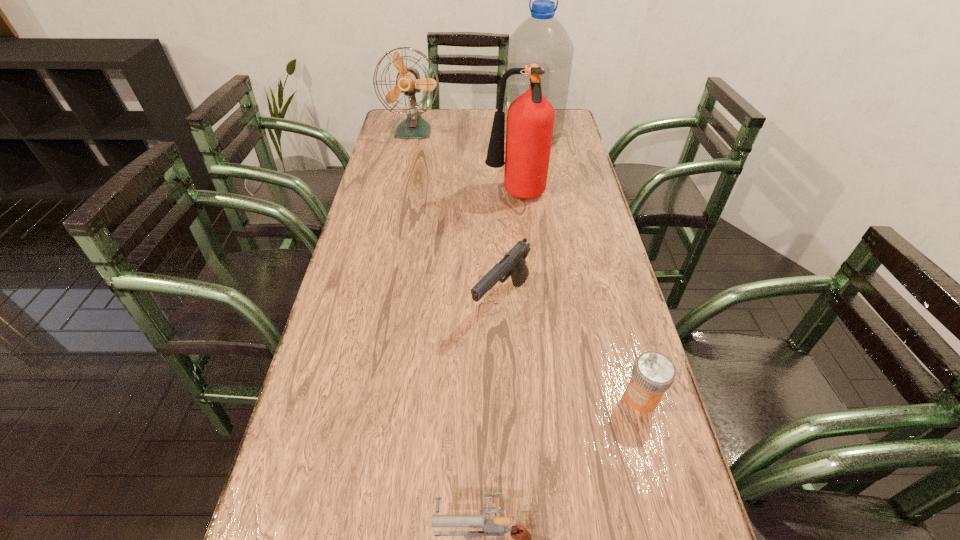
The width and height of the screenshot is (960, 540). In order to click on water jug in this screenshot , I will do `click(541, 39)`.

This screenshot has height=540, width=960. In order to click on fire extinguisher in this screenshot , I will do `click(530, 119)`.

Find the location of `the fourth nearest object`. the fourth nearest object is located at coordinates (530, 119).

Locate an element on the screen. the leftmost object is located at coordinates (408, 81).

You are a GUI agent. You are given a task and a screenshot of the screen. Output one action in this format:
    pyautogui.click(x=<x>, y=<y>)
    Task: Click on the fan
    
    Given the screenshot: What is the action you would take?
    pyautogui.click(x=408, y=81)

Locate an element on the screen. This screenshot has width=960, height=540. the taller gun is located at coordinates (514, 262).

Find the location of a particular element. the third nearest object is located at coordinates (514, 262).

Locate an element on the screen. The width and height of the screenshot is (960, 540). the fifth farthest object is located at coordinates (653, 373).

Locate an element on the screen. free point located on the front of the water jug is located at coordinates (541, 202).

Locate an element on the screen. This screenshot has width=960, height=540. vacant space located 0.100m at the nozzle of the second tallest object is located at coordinates (454, 197).